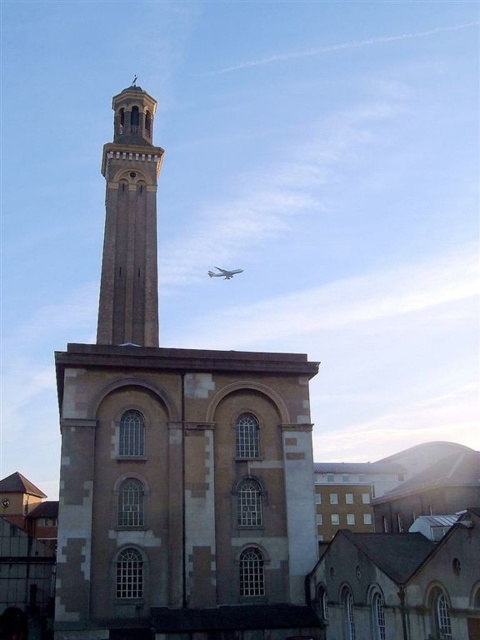
You are an architect analyzing the building structure in the image. You notice two towers, the brown stone tower at center and the light brown stone tower at upper center. Which of these two towers has a greater width?

The brown stone tower at center has a greater width than the light brown stone tower at upper center.

Based on the photo, you are an architect analyzing the image of the historical building and the airplane. Which object, the brown stone tower at center or the white glossy airplane at upper center, has a greater height in the image?

The brown stone tower at center has a greater height compared to the white glossy airplane at upper center.